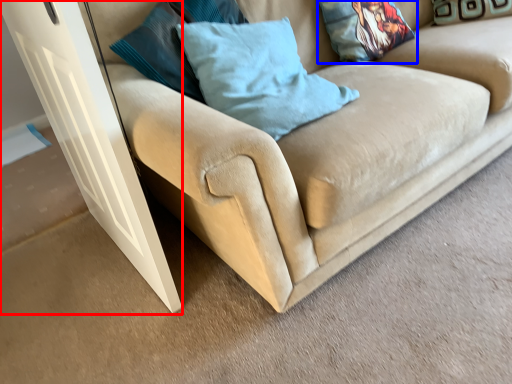
Question: Which object appears closest to the camera in this image, glass door (highlighted by a red box) or pillow (highlighted by a blue box)?

Choices:
 (A) glass door
 (B) pillow

Answer: (A)